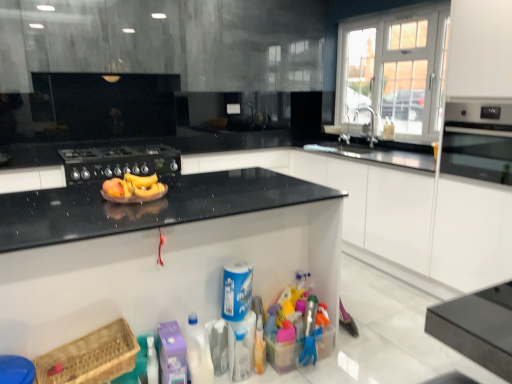
The width and height of the screenshot is (512, 384). What do you see at coordinates (394, 72) in the screenshot?
I see `white glass window at upper right` at bounding box center [394, 72].

At what (x,y) coordinates should I click in order to perform the action: click on brown woven basket at lower left. Please return your answer as a coordinate pair (x, y). The height and width of the screenshot is (384, 512). Looking at the image, I should click on (90, 357).

What are the coordinates of `white glossy cabinet at center, which appears as the second cabinetry when viewed from the front` in the screenshot? It's located at (377, 205).

Find the location of a particular element. The height and width of the screenshot is (384, 512). black matte gas stove at center is located at coordinates (119, 162).

What is the approximate width of black matte gas stove at center?

61.80 centimeters.

This screenshot has height=384, width=512. What do you see at coordinates (156, 252) in the screenshot? I see `white glossy cabinet at lower center, which ranks as the first cabinetry in left-to-right order` at bounding box center [156, 252].

Image resolution: width=512 pixels, height=384 pixels. What do you see at coordinates (236, 291) in the screenshot?
I see `blue plastic canister at center, marked as the 2th cleaning product in a right-to-left arrangement` at bounding box center [236, 291].

The height and width of the screenshot is (384, 512). In order to click on white glass window at upper right in this screenshot , I will do `click(394, 72)`.

Is point (448, 139) less distant than point (174, 333)?

No.

Can you confirm if matte black oven at right is wider than purple plastic container at lower center, acting as the first cleaning product starting from the left?

Yes, matte black oven at right is wider than purple plastic container at lower center, acting as the first cleaning product starting from the left.

Between white glossy cabinet at center, which appears as the second cabinetry when viewed from the front, and white glass window at upper right, which one appears on the right side from the viewer's perspective?

white glass window at upper right.

From the image's perspective, which object appears higher, white glossy cabinet at center, the second cabinetry from the left, or white glass window at upper right?

white glass window at upper right appears higher in the image.

Is white glossy cabinet at center, placed as the 1th cabinetry when sorted from back to front, surrounding white glass window at upper right?

Actually, white glass window at upper right is outside white glossy cabinet at center, placed as the 1th cabinetry when sorted from back to front.

Is white glossy cabinet at center, placed as the 1th cabinetry when sorted from back to front, shorter than white glass window at upper right?

Yes.

Locate an element on the screen. The image size is (512, 384). the 2nd cleaning product positioned below the black matte gas stove at center (from a real-world perspective) is located at coordinates (285, 347).

Based on the photo, from a real-world perspective, is black matte gas stove at center physically below translucent plastic spray bottle at lower center, placed as the fourth cleaning product when sorted from left to right?

No, from a real-world perspective, black matte gas stove at center is not beneath translucent plastic spray bottle at lower center, placed as the fourth cleaning product when sorted from left to right.

Considering the points (149, 172) and (288, 340), which point is in front, point (149, 172) or point (288, 340)?

The point (288, 340) is closer.

Does black matte gas stove at center have a larger size compared to translucent plastic spray bottle at lower center, the first cleaning product from the right?

Yes, black matte gas stove at center is bigger than translucent plastic spray bottle at lower center, the first cleaning product from the right.

At what (x,y) coordinates should I click in order to perform the action: click on cabinetry that is the 1st one when counting upward from the translucent plastic bottle at lower center (from the image's perspective). Please return your answer as a coordinate pair (x, y). The image size is (512, 384). Looking at the image, I should click on (156, 252).

Is white glossy cabinet at lower center, acting as the 2th cabinetry starting from the back, shorter than translucent plastic bottle at lower center?

In fact, white glossy cabinet at lower center, acting as the 2th cabinetry starting from the back, may be taller than translucent plastic bottle at lower center.

From a real-world perspective, is white glossy cabinet at lower center, acting as the 2th cabinetry starting from the back, physically located above or below translucent plastic bottle at lower center?

From a real-world perspective, white glossy cabinet at lower center, acting as the 2th cabinetry starting from the back, is physically above translucent plastic bottle at lower center.

Which is behind, point (285, 221) or point (241, 367)?

Positioned behind is point (285, 221).

Is point (346, 97) closer to viewer compared to point (355, 210)?

No, (346, 97) is further to viewer.

Considering the relative positions of white glass window at upper right and white glossy cabinet at center, which appears as the second cabinetry when viewed from the front, in the image provided, is white glass window at upper right in front of white glossy cabinet at center, which appears as the second cabinetry when viewed from the front,?

No, it is not.

Does white glass window at upper right have a smaller size compared to white glossy cabinet at center, the second cabinetry from the left?

Correct, white glass window at upper right occupies less space than white glossy cabinet at center, the second cabinetry from the left.

There is a brown woven basket at lower left. Where is `home appliance above it (from a real-world perspective)`? home appliance above it (from a real-world perspective) is located at coordinates (478, 140).

Is brown woven basket at lower left oriented towards matte black oven at right?

No.

Is brown woven basket at lower left bigger or smaller than matte black oven at right?

Clearly, brown woven basket at lower left is smaller in size than matte black oven at right.

What's the angular difference between brown woven basket at lower left and matte black oven at right's facing directions?

The angle between the facing direction of brown woven basket at lower left and the facing direction of matte black oven at right is 93 degrees.

Measure the distance between purple plastic container at lower center, which is the fourth cleaning product from right to left, and translucent plastic bottle at lower center.

13.91 inches.

Do you think purple plastic container at lower center, acting as the first cleaning product starting from the left, is within translucent plastic bottle at lower center, or outside of it?

The correct answer is: outside.

Consider the image. From the image's perspective, which is below, purple plastic container at lower center, which is the fourth cleaning product from right to left, or translucent plastic bottle at lower center?

translucent plastic bottle at lower center appears lower in the image.

Looking at this image, who is smaller, purple plastic container at lower center, acting as the first cleaning product starting from the left, or translucent plastic bottle at lower center?

With smaller size is translucent plastic bottle at lower center.

Locate an element on the screen. This screenshot has height=384, width=512. the 4th cleaning product below the matte black oven at right (from a real-world perspective) is located at coordinates (172, 353).

From the image's perspective, starting from the white glass window at upper right, which cabinetry is the 1st one below? Please provide its 2D coordinates.

[(377, 205)]

From the image, which object appears to be nearer to yellow matte banana at center, purple plastic container at lower center, acting as the first cleaning product starting from the left, or blue plastic canister at center, marked as the 2th cleaning product in a right-to-left arrangement?

The object closer to yellow matte banana at center is blue plastic canister at center, marked as the 2th cleaning product in a right-to-left arrangement.

From the image, which object appears to be nearer to translucent plastic bottle at lower center, purple plastic container at lower center, which is the fourth cleaning product from right to left, or white glossy cabinet at lower center, placed as the 1th cabinetry when sorted from front to back?

purple plastic container at lower center, which is the fourth cleaning product from right to left, is positioned closer to the anchor translucent plastic bottle at lower center.

Based on the photo, estimate the real-world distances between objects in this image. Which object is further from translucent plastic bottle at lower center, matte black oven at right or silver metallic faucet at upper right?

silver metallic faucet at upper right is further to translucent plastic bottle at lower center.

Based on their spatial positions, is blue plastic canister at center, marked as the 2th cleaning product in a right-to-left arrangement, or silver metallic faucet at upper right further from black matte gas stove at center?

Among the two, silver metallic faucet at upper right is located further to black matte gas stove at center.

From the image, which object appears to be nearer to brown woven basket at lower left, white glossy cabinet at lower center, which ranks as the first cabinetry in left-to-right order, or white glass window at upper right?

The object closer to brown woven basket at lower left is white glossy cabinet at lower center, which ranks as the first cabinetry in left-to-right order.

Considering their positions, is blue plastic canister at center, the 3th cleaning product from the left, positioned closer to silver metallic faucet at upper right than matte black oven at right?

matte black oven at right is positioned closer to the anchor silver metallic faucet at upper right.

Looking at the image, which one is located closer to brown woven basket at lower left, blue plastic canister at center, marked as the 2th cleaning product in a right-to-left arrangement, or white glossy cabinet at center, the second cabinetry from the left?

Based on the image, blue plastic canister at center, marked as the 2th cleaning product in a right-to-left arrangement, appears to be nearer to brown woven basket at lower left.

Based on their spatial positions, is purple plastic container at lower center, which is the fourth cleaning product from right to left, or white glossy cabinet at lower center, which ranks as the first cabinetry in left-to-right order, further from translucent plastic spray bottle at lower center, placed as the fourth cleaning product when sorted from left to right?

white glossy cabinet at lower center, which ranks as the first cabinetry in left-to-right order, is further to translucent plastic spray bottle at lower center, placed as the fourth cleaning product when sorted from left to right.

Where is `cleaning product situated between translucent plastic bottle at lower center and matte black oven at right from left to right`? The width and height of the screenshot is (512, 384). cleaning product situated between translucent plastic bottle at lower center and matte black oven at right from left to right is located at coordinates (285, 347).

The width and height of the screenshot is (512, 384). I want to click on faucet between brown woven basket at lower left and matte black oven at right in the horizontal direction, so click(x=370, y=122).

This screenshot has height=384, width=512. In order to click on faucet located between yellow matte banana at center and white glass window at upper right in the left-right direction in this screenshot , I will do `click(370, 122)`.

Locate an element on the screen. banana situated between black matte gas stove at center and white glass window at upper right from left to right is located at coordinates (133, 188).